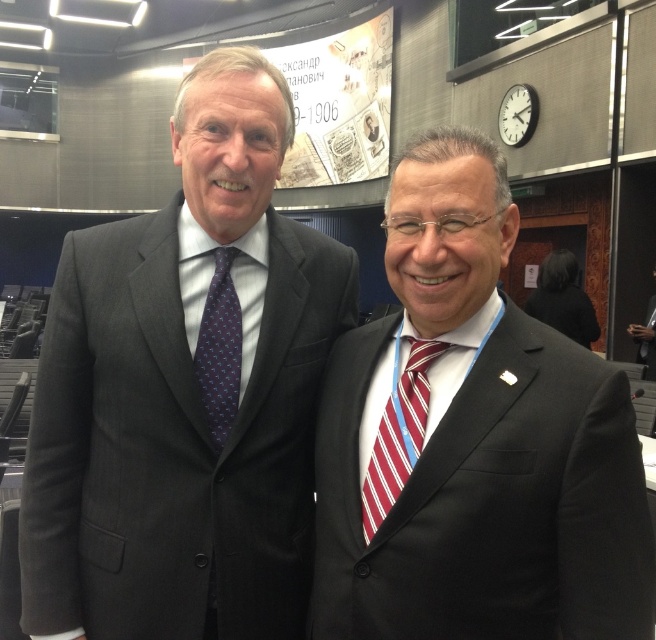
You are a photographer at a conference. You need to capture a photo of the dark gray suit at left and the matte black suit at right. Based on their positions, which suit is positioned higher in the frame?

The dark gray suit at left is positioned higher in the frame than the matte black suit at right because it is located above it.

You are organizing a formal event and need to arrange seating for two guests wearing the dark gray suit at left and the matte black suit at right. According to their positions in the image, which guest should sit on the left side of the table?

The guest wearing the dark gray suit at left should sit on the left side of the table because in the image, the dark gray suit at left is positioned on the left side of the matte black suit at right.